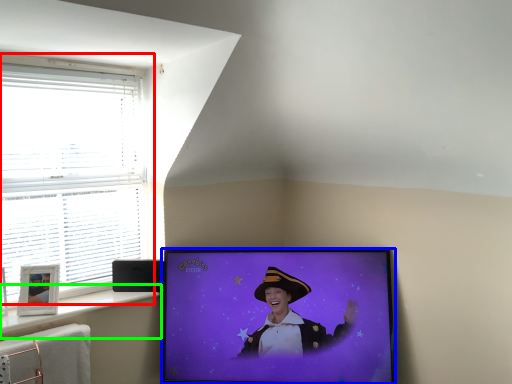
Question: Which object is the farthest from window (highlighted by a red box)? Choose among these: television (highlighted by a blue box) or window sill (highlighted by a green box).

Choices:
 (A) television
 (B) window sill

Answer: (A)